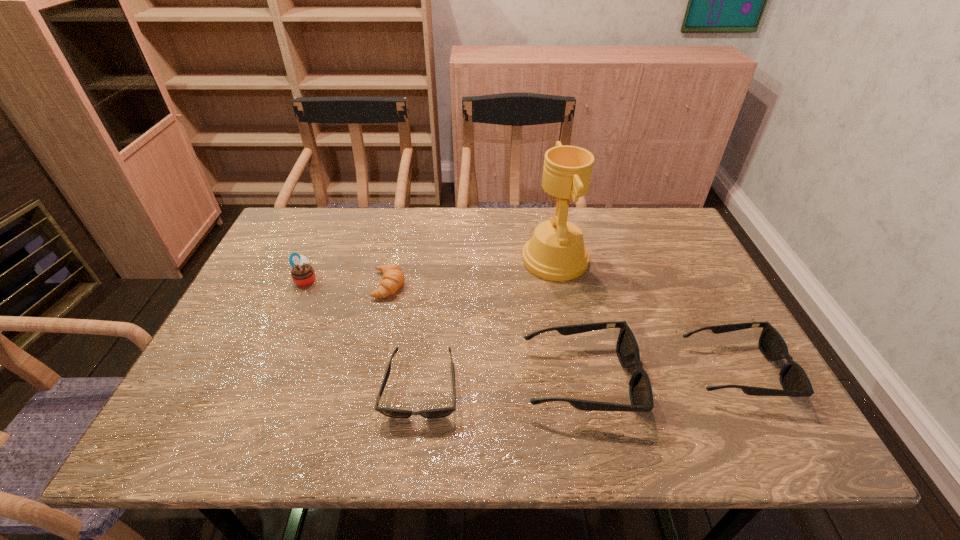
The sunglassess are evenly distributed in the image. To maintain this, where would you place another sunglasses on the left? Please point to a free space. Please provide its 2D coordinates. Your answer should be formatted as a tuple, i.e. [(x, y)], where the tuple contains the x and y coordinates of a point satisfying the conditions above.

[(255, 397)]